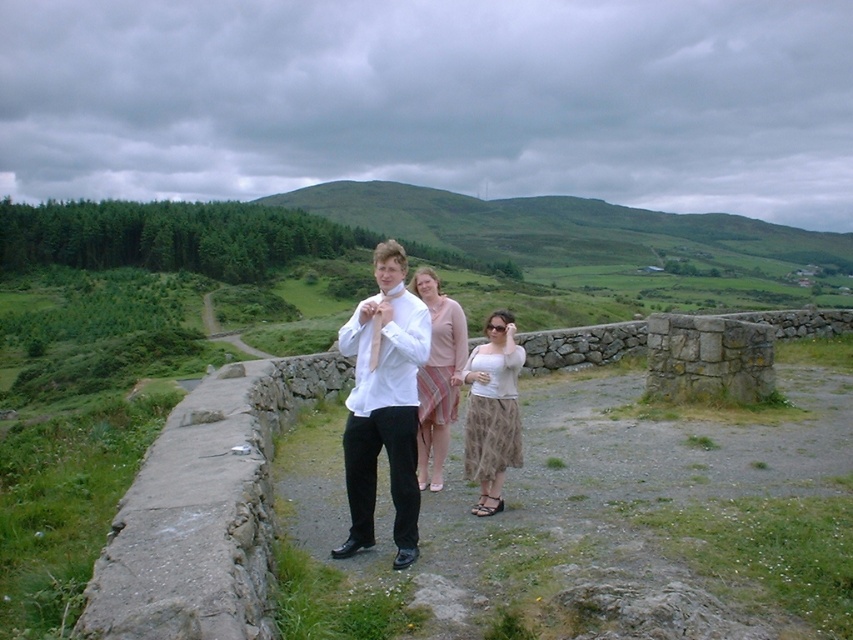
Question: Where is beige textured skirt at center located in relation to pink striped skirt at center in the image?

Choices:
 (A) below
 (B) above

Answer: (A)

Question: Can you confirm if beige textured skirt at center is bigger than pink striped skirt at center?

Choices:
 (A) yes
 (B) no

Answer: (B)

Question: Among these points, which one is nearest to the camera?

Choices:
 (A) (392, 413)
 (B) (468, 465)
 (C) (450, 330)

Answer: (A)

Question: Among these points, which one is farthest from the camera?

Choices:
 (A) (442, 442)
 (B) (386, 381)
 (C) (512, 442)

Answer: (A)

Question: Which of the following is the farthest from the observer?

Choices:
 (A) (495, 340)
 (B) (368, 349)

Answer: (A)

Question: Where is matte white shirt at center located in relation to pink striped skirt at center in the image?

Choices:
 (A) right
 (B) left

Answer: (B)